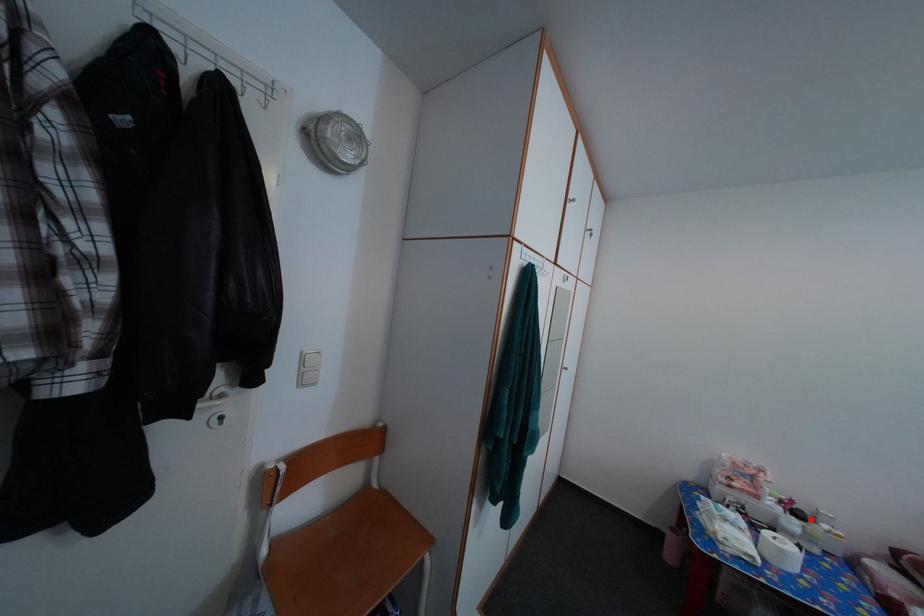
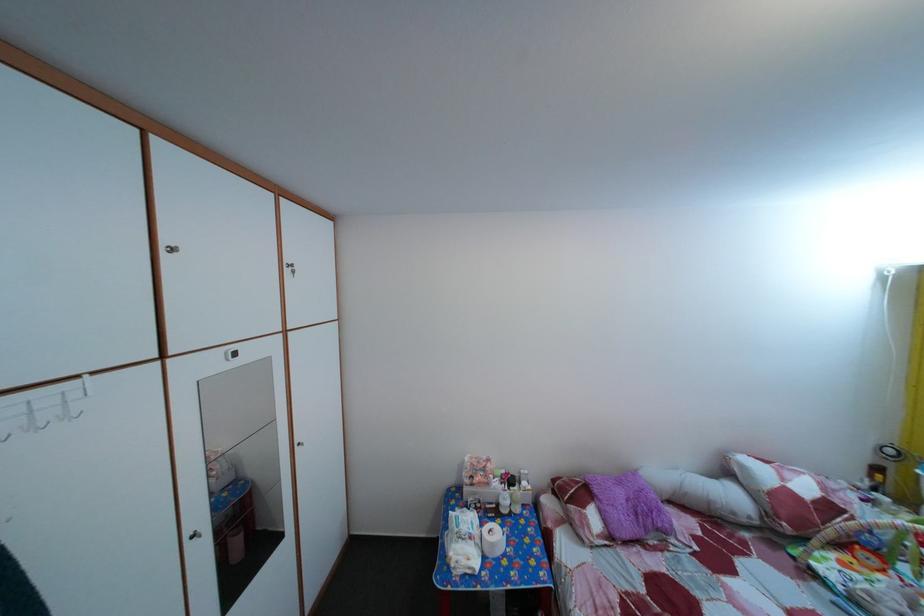
In the second image, find the point that corresponds to the highlighted location in the first image.

(524, 485)